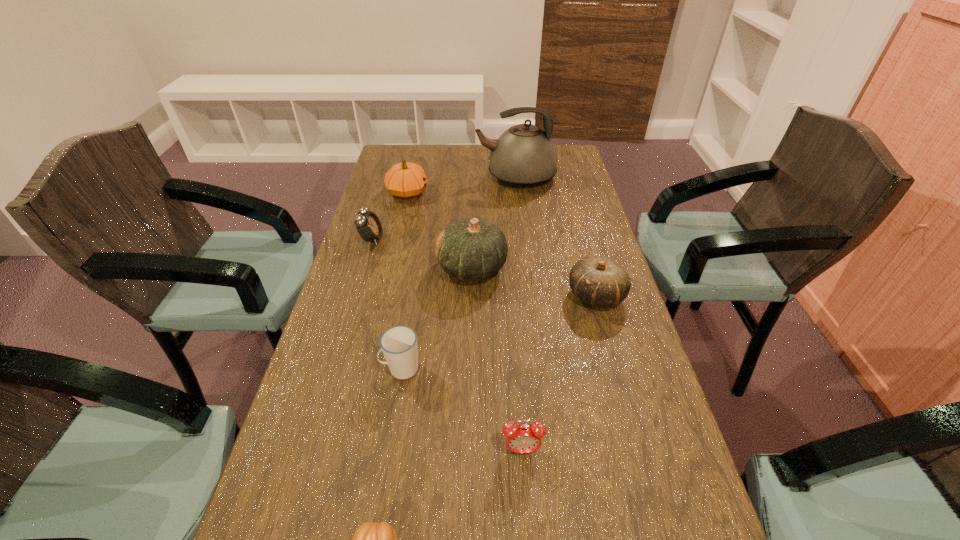
You are a GUI agent. You are given a task and a screenshot of the screen. Output one action in this format:
    pyautogui.click(x=<x>, y=<y>)
    Task: Click on the empty space that is in between the tallest object and the nearer alarm clock
    This screenshot has width=960, height=540.
    Given the screenshot: What is the action you would take?
    pyautogui.click(x=519, y=314)

In order to click on free spot between the rightmost gourd and the tallest gourd in this screenshot , I will do `click(534, 282)`.

Find the location of a particular element. empty location between the seventh farthest object and the cup is located at coordinates (462, 409).

This screenshot has height=540, width=960. In order to click on the sixth closest object to the nearest object in this screenshot , I will do `click(406, 180)`.

Select which object appears as the second closest to the second tallest object. Please provide its 2D coordinates. Your answer should be formatted as a tuple, i.e. [(x, y)], where the tuple contains the x and y coordinates of a point satisfying the conditions above.

[(369, 227)]

Identify which gourd is located as the nearest to the farther alarm clock. Please provide its 2D coordinates. Your answer should be formatted as a tuple, i.e. [(x, y)], where the tuple contains the x and y coordinates of a point satisfying the conditions above.

[(406, 180)]

Choose which gourd is the second nearest neighbor to the nearest object. Please provide its 2D coordinates. Your answer should be formatted as a tuple, i.e. [(x, y)], where the tuple contains the x and y coordinates of a point satisfying the conditions above.

[(597, 280)]

Identify the location of free spot that satisfies the following two spatial constraints: 1. on the face of the rightmost gourd; 2. on the right side of the farther alarm clock. (355, 295).